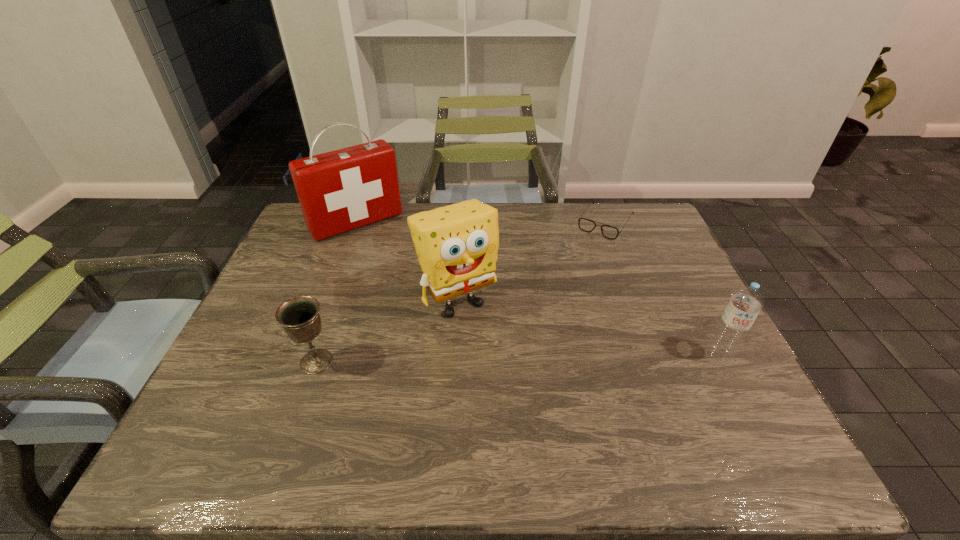
At what (x,y) coordinates should I click in order to perform the action: click on free space located 0.210m on the face of the third nearest object. Please return your answer as a coordinate pair (x, y). Looking at the image, I should click on (518, 383).

Identify the location of free spot located on the face of the third nearest object. (525, 394).

Image resolution: width=960 pixels, height=540 pixels. What are the coordinates of `vacant space positioned on the face of the third nearest object` in the screenshot? It's located at (484, 335).

Image resolution: width=960 pixels, height=540 pixels. In order to click on free location located on the front-facing side of the second object from right to left in this screenshot , I will do `click(549, 307)`.

I want to click on vacant space situated 0.310m on the front-facing side of the second object from right to left, so click(555, 298).

I want to click on free spot located 0.140m on the front-facing side of the second object from right to left, so click(x=579, y=263).

Locate an element on the screen. The image size is (960, 540). vacant space located on the front face of the first-aid kit is located at coordinates (418, 293).

Identify the location of vacant area situated on the front face of the first-aid kit. (409, 283).

You are a GUI agent. You are given a task and a screenshot of the screen. Output one action in this format:
    pyautogui.click(x=<x>, y=<y>)
    Task: Click on the free region located on the front face of the first-aid kit
    The image size is (960, 540).
    Given the screenshot: What is the action you would take?
    pyautogui.click(x=400, y=271)

You are a GUI agent. You are given a task and a screenshot of the screen. Output one action in this format:
    pyautogui.click(x=<x>, y=<y>)
    Task: Click on the sunglasses that is at the far edge
    This screenshot has width=960, height=540.
    Given the screenshot: What is the action you would take?
    pyautogui.click(x=587, y=225)